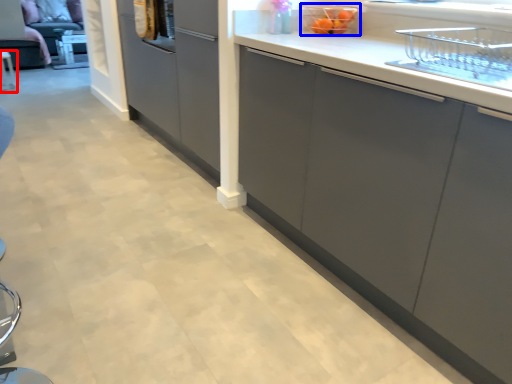
Question: Which object is closer to the camera taking this photo, furniture (highlighted by a red box) or appliance (highlighted by a blue box)?

Choices:
 (A) furniture
 (B) appliance

Answer: (B)